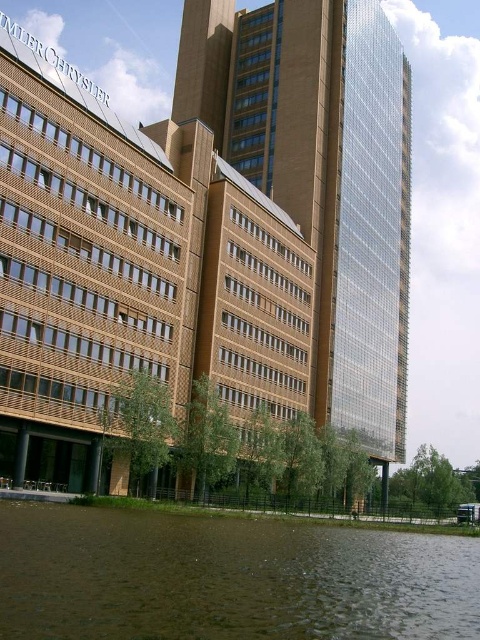
You are standing in front of the modern urban landscape described. You want to take a photo of the glassy reflective tower at center without the brown murky water at lower center appearing in the frame. Is this possible given their positions?

The glassy reflective tower at center is further to the viewer than brown murky water at lower center, so yes, you can take a photo of the glassy reflective tower at center without the brown murky water at lower center by adjusting the camera angle to exclude the water since it is closer to the camera.

You are a city planner evaluating the urban layout. Considering the glassy reflective tower at center and the brown murky water at lower center, which object occupies a larger vertical space in the image?

The glassy reflective tower at center is much taller than the brown murky water at lower center, so it occupies a larger vertical space in the image.